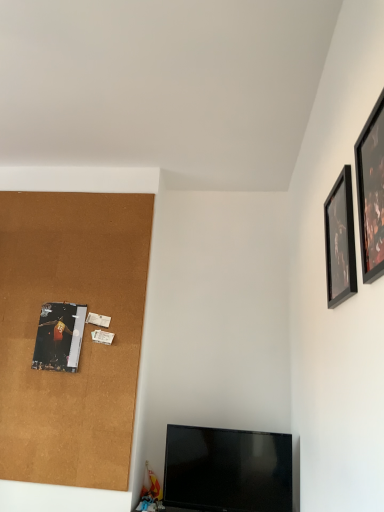
Question: Is cork board at left spatially inside black matte picture frame at upper right, the 2th picture frame viewed from the front, or outside of it?

Choices:
 (A) inside
 (B) outside

Answer: (B)

Question: Based on their sizes in the image, would you say cork board at left is bigger or smaller than black matte picture frame at upper right, placed as the 2th picture frame when sorted from back to front?

Choices:
 (A) small
 (B) big

Answer: (B)

Question: Which is farther from the cork board at left?

Choices:
 (A) black glossy tv at lower center
 (B) metallic silver poster at left, which is counted as the 1th picture frame, starting from the back
 (C) black matte picture frame at upper right, the 2th picture frame viewed from the front
 (D) black glossy picture frame at upper right, which ranks as the 2th picture frame in left-to-right order

Answer: (D)

Question: Estimate the real-world distances between objects in this image. Which object is closer to the metallic silver poster at left, the 1th picture frame when ordered from left to right?

Choices:
 (A) black matte picture frame at upper right, placed as the third picture frame when sorted from left to right
 (B) black glossy tv at lower center
 (C) cork board at left
 (D) black glossy picture frame at upper right, which is the 2th picture frame from right to left

Answer: (C)